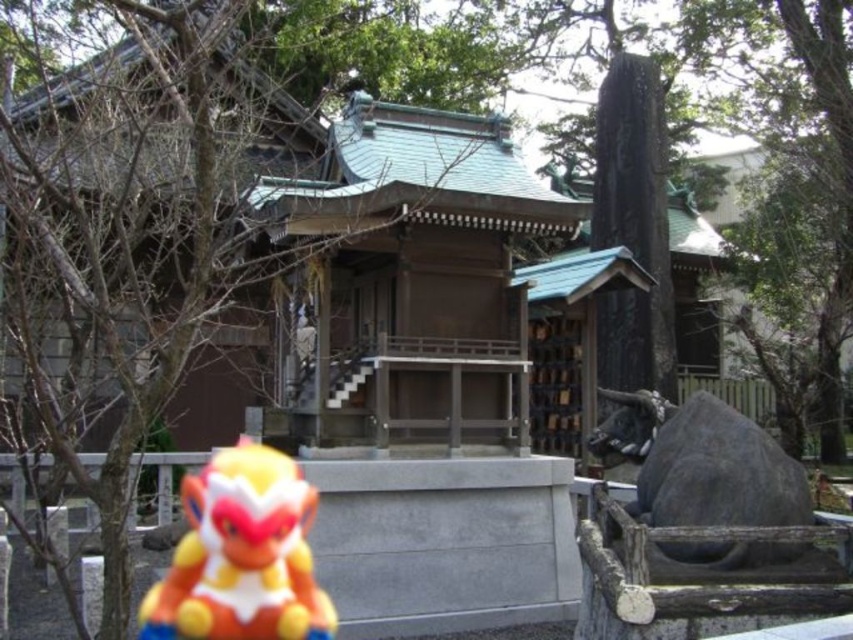
You are a visitor at the shrine and want to take a photo of the matte plastic monkey at lower left and the gray stone bull at right. Which object should you focus on if you want both to be in sharp focus?

You should focus on the gray stone bull at right because it is closer to you than the matte plastic monkey at lower left, ensuring both are in focus.

You are a visitor at the shrine and want to take a photo that includes both the matte plastic monkey at lower left and the gray stone bull at right. Since you have a camera with a fixed focal length, you need to position yourself so both objects are in frame. Considering their sizes, which object should you focus on to ensure both are clearly visible?

The matte plastic monkey at lower left is bigger than the gray stone bull at right. To ensure both are clearly visible in the photo, focus on the matte plastic monkey at lower left since it is larger and likely closer to the camera, allowing the smaller gray stone bull at right to remain in focus as well.

You are standing at the entrance of the traditional Japanese shrine and see the matte plastic monkey at lower left. If you move 0.1 units to the right along the horizontal axis, will you be closer to the shrine or farther away?

Moving 0.1 units to the right along the horizontal axis from the matte plastic monkey at lower left would position you closer to the shrine since the monkey is located at point [241,556]. Moving right increases the x coordinate, which in this context likely means moving towards the shrine.